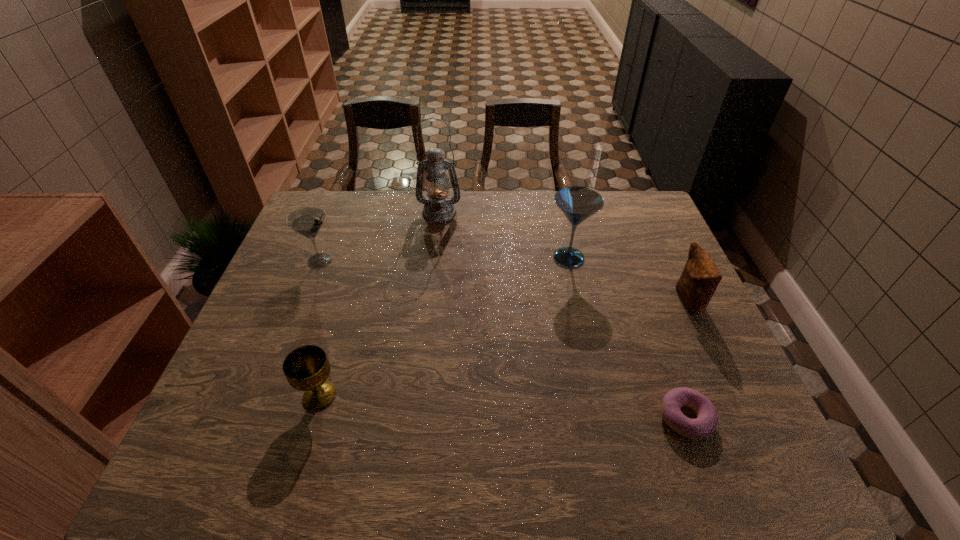
Locate an element on the screen. The width and height of the screenshot is (960, 540). the tallest object is located at coordinates (438, 208).

What are the coordinates of `the farthest object` in the screenshot? It's located at (438, 208).

I want to click on the fourth object from left to right, so point(577,203).

The image size is (960, 540). What are the coordinates of `the shorter martini` in the screenshot? It's located at (308, 221).

Locate an element on the screen. Image resolution: width=960 pixels, height=540 pixels. the leftmost object is located at coordinates (308, 221).

Identify the location of the fourth farthest object. This screenshot has height=540, width=960. click(700, 278).

This screenshot has width=960, height=540. In order to click on the fourth tallest object in this screenshot , I will do `click(700, 278)`.

Locate an element on the screen. This screenshot has width=960, height=540. chalice is located at coordinates (306, 368).

Where is `the fifth tallest object`? the fifth tallest object is located at coordinates (306, 368).

The height and width of the screenshot is (540, 960). I want to click on the shortest object, so click(x=703, y=426).